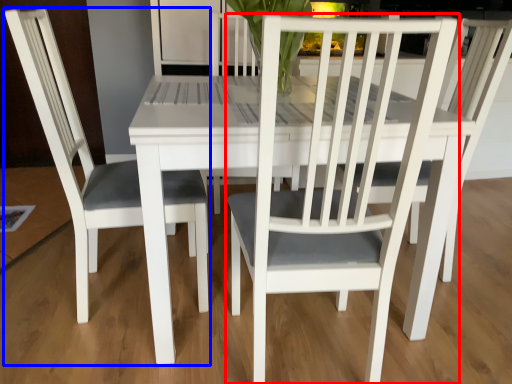
Question: Which of the following is the farthest to the observer, chair (highlighted by a red box) or chair (highlighted by a blue box)?

Choices:
 (A) chair
 (B) chair

Answer: (B)